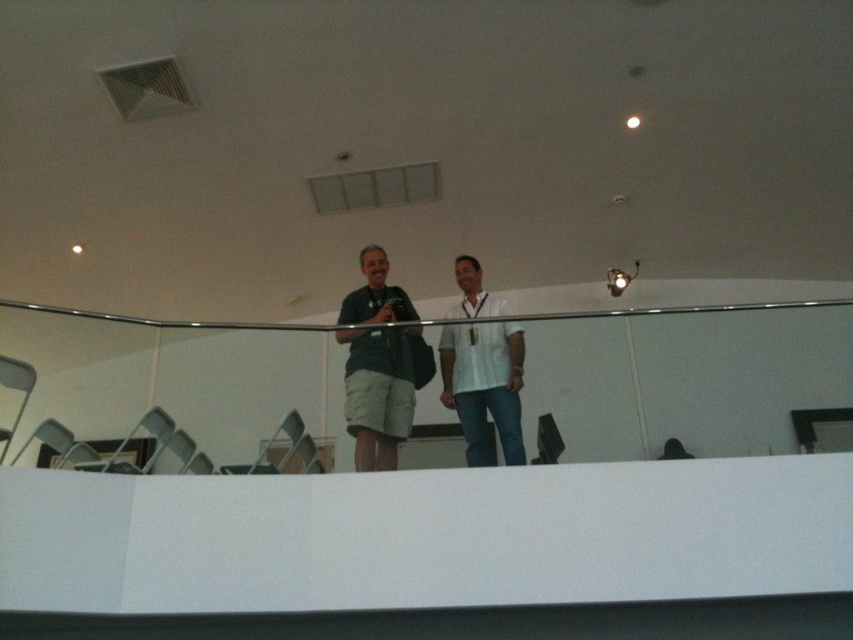
Is dark green fabric shirt at center positioned in front of white striped shirt at center?

That is True.

Is dark green fabric shirt at center behind white striped shirt at center?

No, it is in front of white striped shirt at center.

Is point (370, 256) positioned behind point (514, 330)?

Yes, it is.

Where is `dark green fabric shirt at center`? Image resolution: width=853 pixels, height=640 pixels. dark green fabric shirt at center is located at coordinates (376, 364).